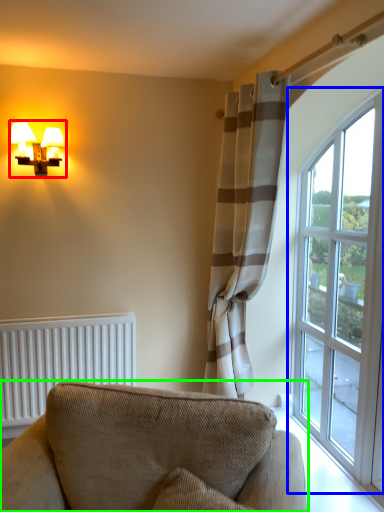
Question: Considering the real-world distances, which object is farthest from table lamp (highlighted by a red box)? window (highlighted by a blue box) or studio couch (highlighted by a green box)?

Choices:
 (A) window
 (B) studio couch

Answer: (A)